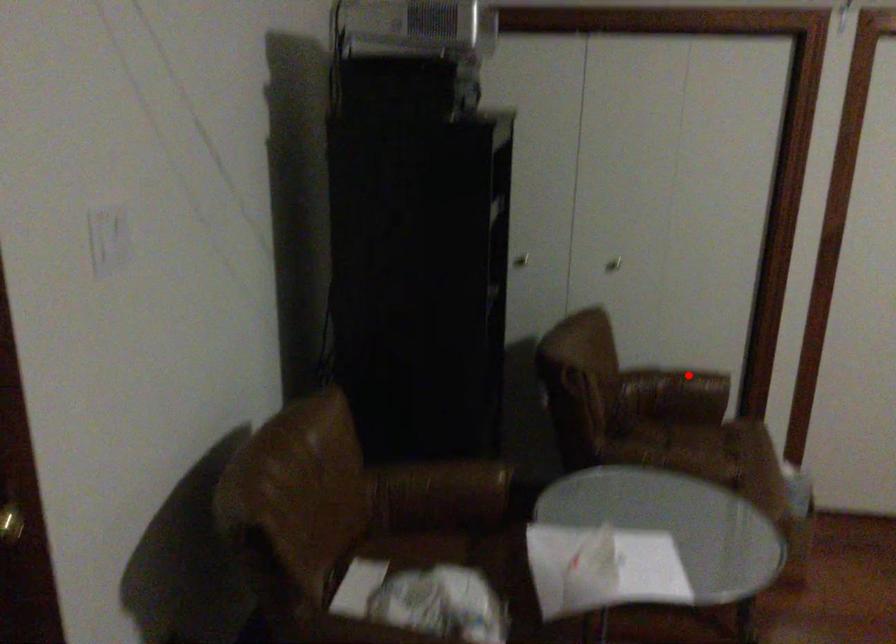
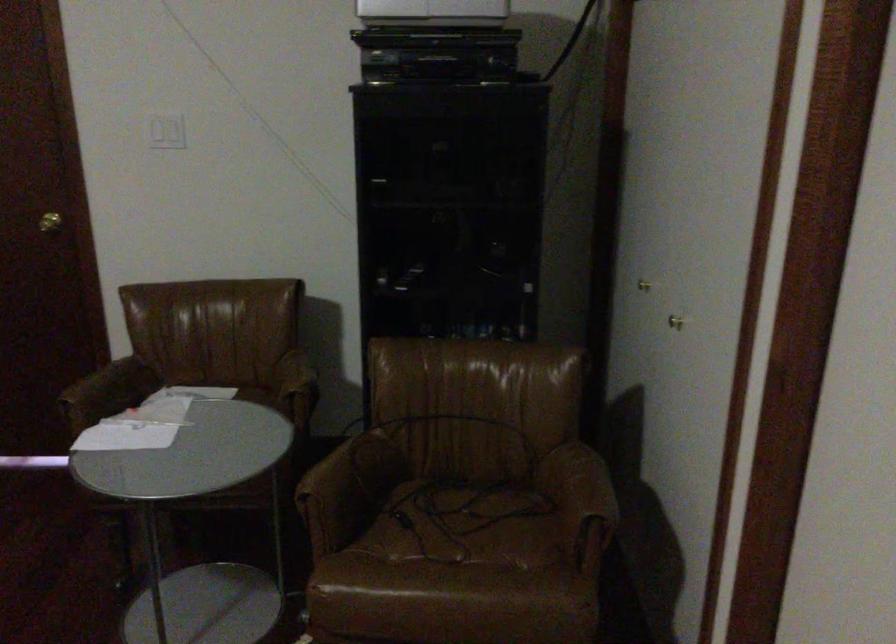
Find the pixel in the second image that matches the highlighted location in the first image.

(582, 485)